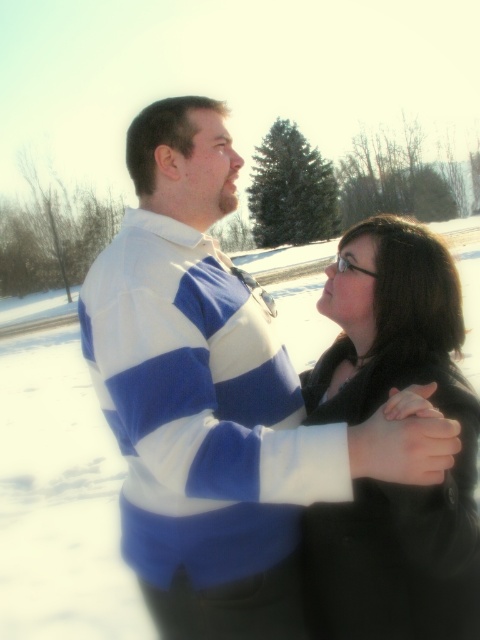
Question: Among these points, which one is farthest from the camera?

Choices:
 (A) (430, 504)
 (B) (264, 492)

Answer: (A)

Question: Is the position of blue striped sweater at center less distant than that of black matte coat at center?

Choices:
 (A) no
 (B) yes

Answer: (B)

Question: Which of the following is the closest to the observer?

Choices:
 (A) (369, 314)
 (B) (214, 257)

Answer: (B)

Question: Considering the relative positions of blue striped sweater at center and black matte coat at center in the image provided, where is blue striped sweater at center located with respect to black matte coat at center?

Choices:
 (A) left
 (B) right

Answer: (A)

Question: Which point is farther from the camera taking this photo?

Choices:
 (A) (168, 632)
 (B) (455, 294)

Answer: (B)

Question: Does blue striped sweater at center appear over black matte coat at center?

Choices:
 (A) yes
 (B) no

Answer: (A)